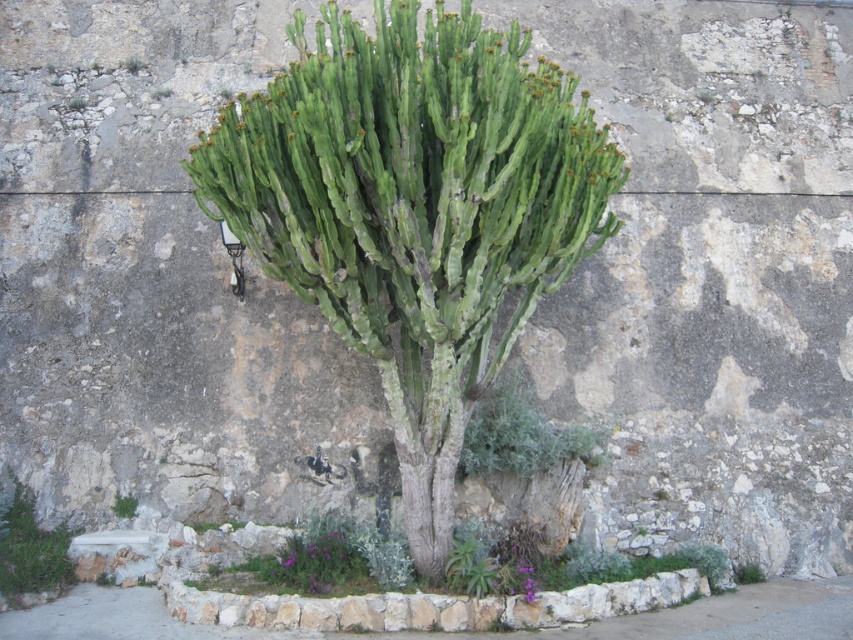
Question: Which object is closer to the camera taking this photo?

Choices:
 (A) green woody at center
 (B) green succulent at lower left

Answer: (A)

Question: Is green woody at center positioned at the back of purple matte plant at lower left?

Choices:
 (A) no
 (B) yes

Answer: (B)

Question: Which object is positioned farthest from the purple matte plant at lower left?

Choices:
 (A) green woody at center
 (B) green succulent at lower left

Answer: (A)

Question: Does green woody at center lie behind purple matte plant at lower left?

Choices:
 (A) yes
 (B) no

Answer: (A)

Question: Which object is positioned farthest from the green succulent at lower left?

Choices:
 (A) purple matte plant at lower left
 (B) green woody at center

Answer: (B)

Question: Is green woody at center above purple matte plant at lower left?

Choices:
 (A) yes
 (B) no

Answer: (A)